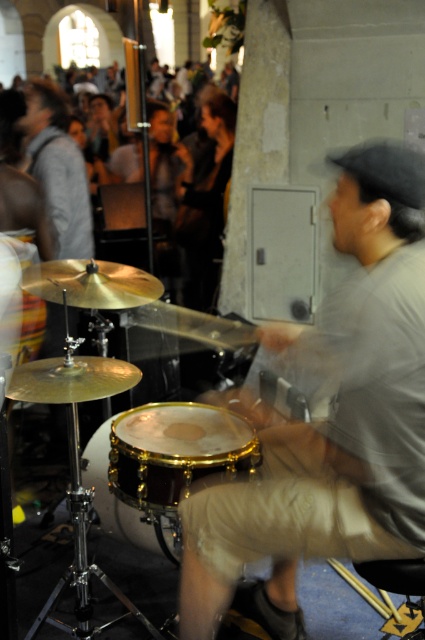
Question: Observing the image, what is the correct spatial positioning of shiny gold snare drum at center in reference to gold-brushed snare drum at center?

Choices:
 (A) below
 (B) above

Answer: (B)

Question: Among these points, which one is farthest from the camera?

Choices:
 (A) (240, 545)
 (B) (175, 561)

Answer: (B)

Question: Which object is positioned farthest from the gray matte shirt at upper left?

Choices:
 (A) shiny gold snare drum at center
 (B) gold-brushed snare drum at center
 (C) light gray cotton shirt at center

Answer: (C)

Question: Is shiny gold snare drum at center below gold-brushed snare drum at center?

Choices:
 (A) no
 (B) yes

Answer: (A)

Question: Which object is closer to the camera taking this photo?

Choices:
 (A) shiny gold snare drum at center
 (B) gray matte shirt at upper left
 (C) light gray cotton shirt at center

Answer: (C)

Question: Does light gray cotton shirt at center come behind gray matte shirt at upper left?

Choices:
 (A) yes
 (B) no

Answer: (B)